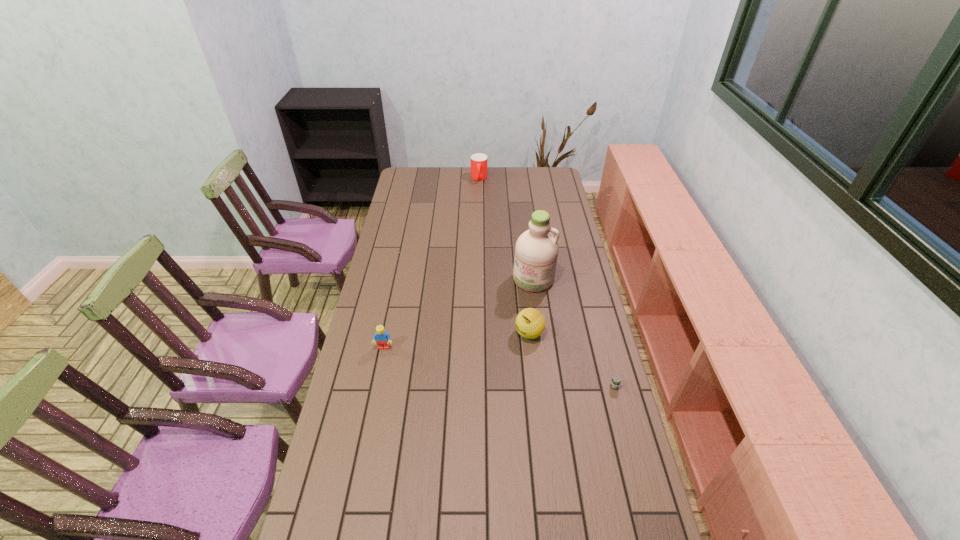
Locate an element on the screen. This screenshot has width=960, height=540. free space on the desktop that is between the leftmost object and the rightmost object and is positioned on the front label of the second farthest object is located at coordinates (497, 367).

The width and height of the screenshot is (960, 540). What are the coordinates of `vacant space on the desktop that is between the leftmost object and the rightmost object and is positioned on the side of the cup with the handle` in the screenshot? It's located at (466, 361).

Locate an element on the screen. This screenshot has width=960, height=540. vacant space on the desktop that is between the leftmost object and the shortest object and is positioned on the logo side of the softball is located at coordinates (485, 364).